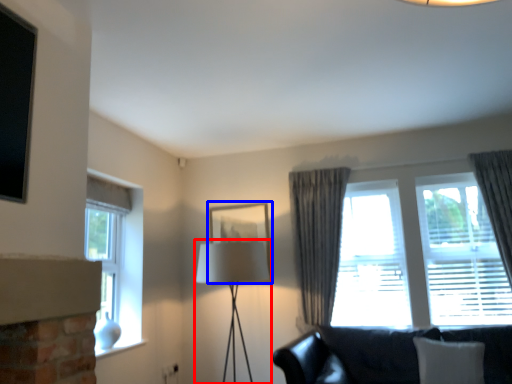
Question: Which of the following is the farthest to the observer, table lamp (highlighted by a red box) or picture frame (highlighted by a blue box)?

Choices:
 (A) table lamp
 (B) picture frame

Answer: (B)